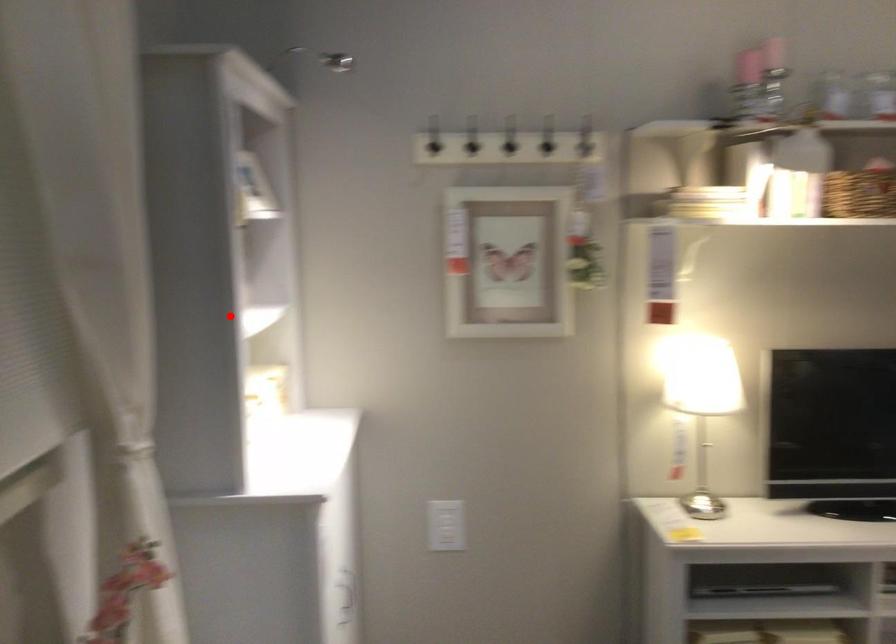
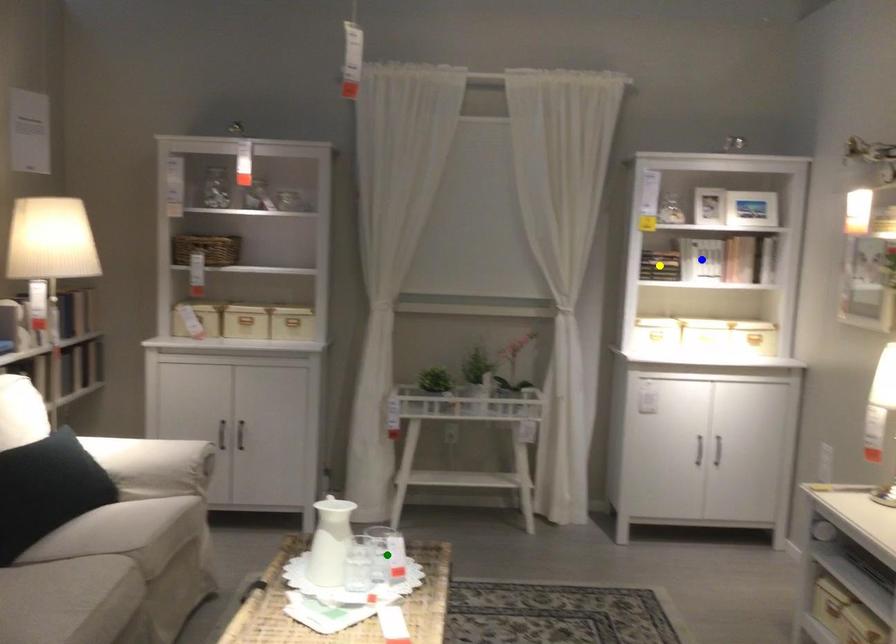
Question: I am providing you with two images of the same scene from different viewpoints. A red point is marked on the first image. You are given multiple points on the second image. Which mark in image 2 goes with the point in image 1?

Choices:
 (A) green point
 (B) blue point
 (C) yellow point

Answer: (B)